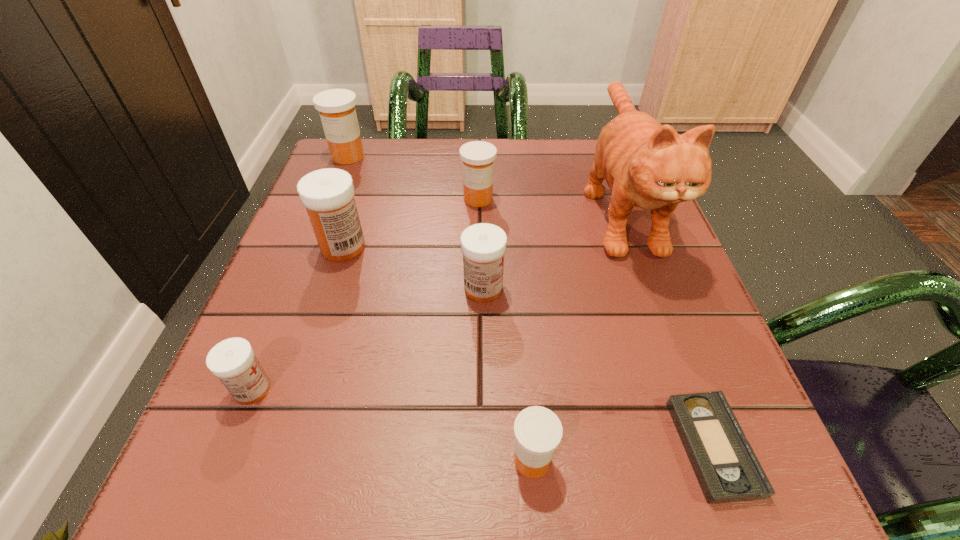
Image resolution: width=960 pixels, height=540 pixels. I want to click on orange medicine that is the second closest to the rightmost white medicine, so click(538, 431).

Select which orange medicine appears as the third closest to the biggest white medicine. Please provide its 2D coordinates. Your answer should be formatted as a tuple, i.e. [(x, y)], where the tuple contains the x and y coordinates of a point satisfying the conditions above.

[(538, 431)]

Locate which white medicine is the second closest to the second nearest white medicine. Please provide its 2D coordinates. Your answer should be formatted as a tuple, i.e. [(x, y)], where the tuple contains the x and y coordinates of a point satisfying the conditions above.

[(233, 361)]

Find the location of a particular element. The width and height of the screenshot is (960, 540). white medicine that is the second closest to the second farthest white medicine is located at coordinates (233, 361).

Where is `free location that satisfies the following two spatial constraints: 1. on the label of the second orange medicine from left to right; 2. on the right side of the videotape`? Image resolution: width=960 pixels, height=540 pixels. free location that satisfies the following two spatial constraints: 1. on the label of the second orange medicine from left to right; 2. on the right side of the videotape is located at coordinates (477, 447).

Where is `vacant space that satisfies the following two spatial constraints: 1. on the face of the tallest object; 2. on the label of the nearest orange medicine`? vacant space that satisfies the following two spatial constraints: 1. on the face of the tallest object; 2. on the label of the nearest orange medicine is located at coordinates (712, 460).

Image resolution: width=960 pixels, height=540 pixels. I want to click on free location that satisfies the following two spatial constraints: 1. on the front side of the videotape; 2. on the right side of the rightmost white medicine, so click(x=485, y=447).

The width and height of the screenshot is (960, 540). Identify the location of vacant space that satisfies the following two spatial constraints: 1. on the label of the shortest object; 2. on the right side of the farthest medicine. (234, 447).

I want to click on free point that satisfies the following two spatial constraints: 1. on the label of the second biggest orange medicine; 2. on the left side of the shortest object, so click(x=477, y=447).